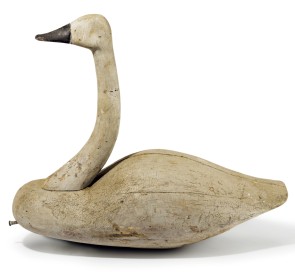
You are a GUI agent. You are given a task and a screenshot of the screen. Output one action in this format:
    pyautogui.click(x=<x>, y=<y>)
    Task: Click on the wooden goose decoy
    
    Given the screenshot: What is the action you would take?
    pyautogui.click(x=46, y=199)